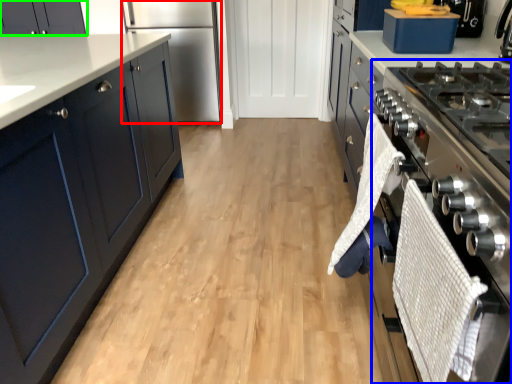
Question: Based on their relative distances, which object is nearer to refrigerator (highlighted by a red box)? Choose from oven (highlighted by a blue box) and cabinetry (highlighted by a green box).

Choices:
 (A) oven
 (B) cabinetry

Answer: (B)